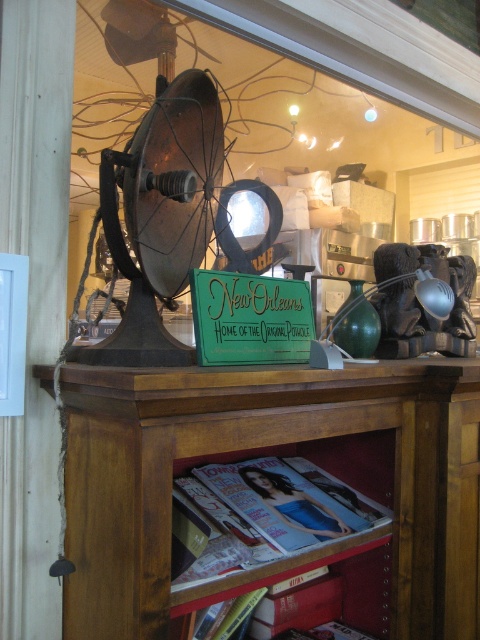
Is metallic globe at upper center positioned at the back of green wood sign at center?

Yes, metallic globe at upper center is behind green wood sign at center.

Is metallic globe at upper center above green wood sign at center?

Indeed, metallic globe at upper center is positioned over green wood sign at center.

Does point (355, 124) lie in front of point (192, 278)?

That is False.

Where is `metallic globe at upper center`? The height and width of the screenshot is (640, 480). metallic globe at upper center is located at coordinates (262, 129).

Is wooden bookshelf at center thinner than green wood sign at center?

In fact, wooden bookshelf at center might be wider than green wood sign at center.

In order to click on wooden bookshelf at center in this screenshot , I will do `click(265, 449)`.

The image size is (480, 640). I want to click on wooden bookshelf at center, so click(x=265, y=449).

Which is below, wooden bookshelf at center or metallic globe at upper center?

Positioned lower is wooden bookshelf at center.

Measure the distance between wooden bookshelf at center and camera.

A distance of 28.82 inches exists between wooden bookshelf at center and camera.

Locate an element on the screen. wooden bookshelf at center is located at coordinates (265, 449).